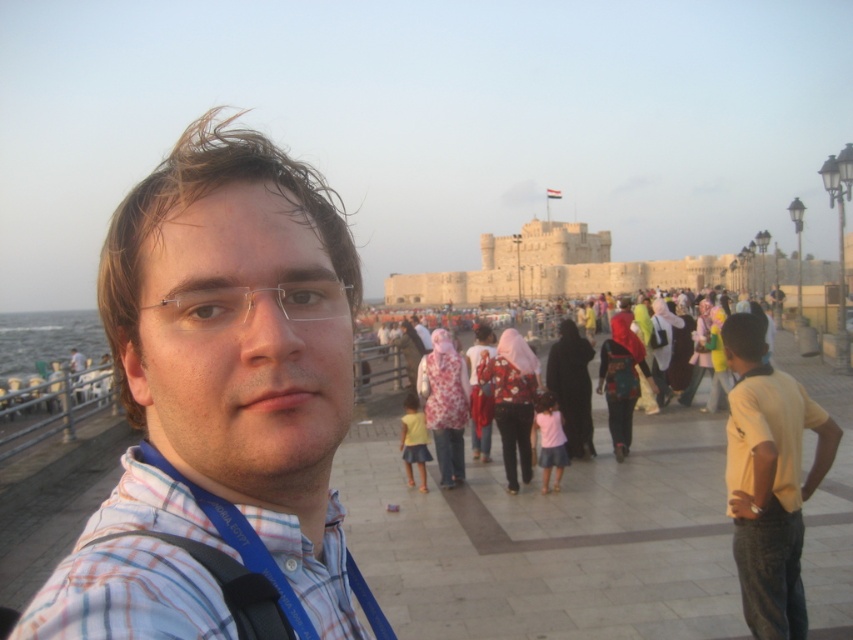
Question: Does multicolored fabric people at center have a larger size compared to black fabric suspenders at lower left?

Choices:
 (A) yes
 (B) no

Answer: (A)

Question: Among these objects, which one is farthest from the camera?

Choices:
 (A) plaid shirt at center
 (B) yellow cotton shirt at right
 (C) black fabric suspenders at lower left

Answer: (B)

Question: Is yellow cotton shirt at right to the right of clear plastic glasses at center from the viewer's perspective?

Choices:
 (A) no
 (B) yes

Answer: (B)

Question: Which point appears closest to the camera in this image?

Choices:
 (A) (300, 163)
 (B) (550, 349)
 (C) (190, 321)
 (D) (793, 515)

Answer: (C)

Question: In this image, where is clear plastic glasses at center located relative to multicolored fabric people at center?

Choices:
 (A) above
 (B) below

Answer: (A)

Question: Which of the following is the farthest from the observer?

Choices:
 (A) plaid shirt at center
 (B) black fabric suspenders at lower left
 (C) multicolored fabric people at center

Answer: (C)